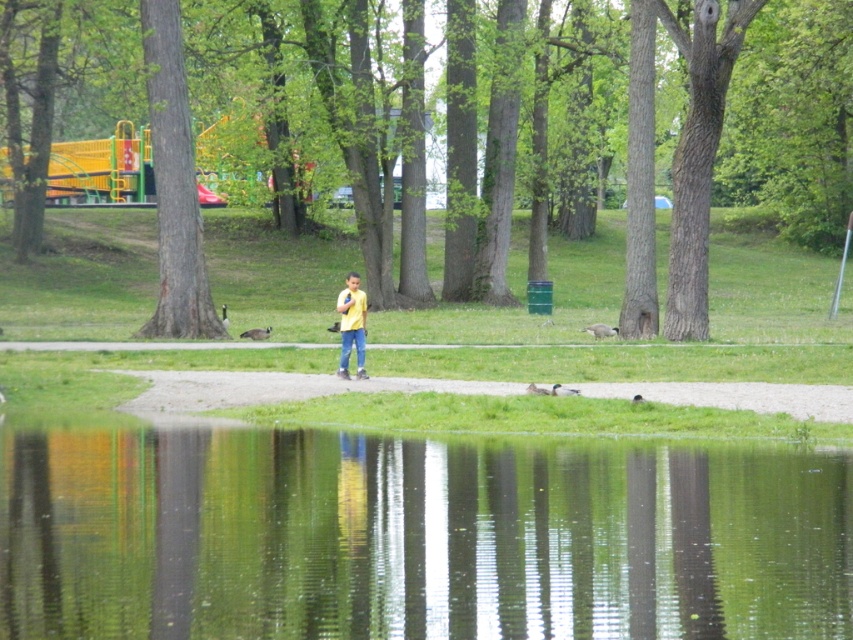
Between green reflective water at center and brown textured tree at center, which one is positioned higher?

brown textured tree at center

Is green reflective water at center shorter than brown textured tree at center?

Yes, green reflective water at center is shorter than brown textured tree at center.

You are a GUI agent. You are given a task and a screenshot of the screen. Output one action in this format:
    pyautogui.click(x=<x>, y=<y>)
    Task: Click on the green reflective water at center
    Image resolution: width=853 pixels, height=640 pixels.
    Given the screenshot: What is the action you would take?
    pyautogui.click(x=415, y=536)

Does brown textured tree at center appear on the right side of brown rough tree at left?

Correct, you'll find brown textured tree at center to the right of brown rough tree at left.

The image size is (853, 640). Describe the element at coordinates (795, 115) in the screenshot. I see `brown textured tree at center` at that location.

What are the coordinates of `brown textured tree at center` in the screenshot? It's located at 795,115.

What do you see at coordinates (173, 186) in the screenshot? The image size is (853, 640). I see `brown rough tree at left` at bounding box center [173, 186].

Looking at this image, who is more forward, (172, 35) or (340, 378)?

Point (340, 378) is more forward.

Does point (181, 60) come behind point (364, 316)?

Yes, it is.

Identify the location of brown rough tree at left. The width and height of the screenshot is (853, 640). (173, 186).